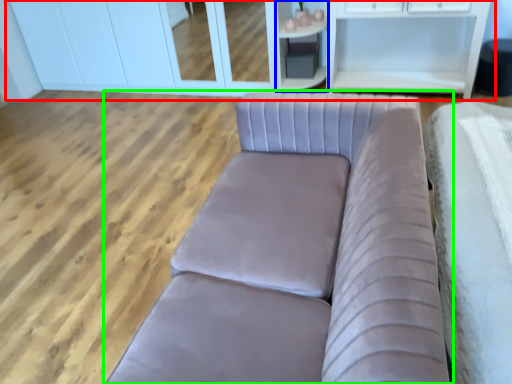
Question: Which is farther away from dresser (highlighted by a red box)? cabinetry (highlighted by a blue box) or studio couch (highlighted by a green box)?

Choices:
 (A) cabinetry
 (B) studio couch

Answer: (B)